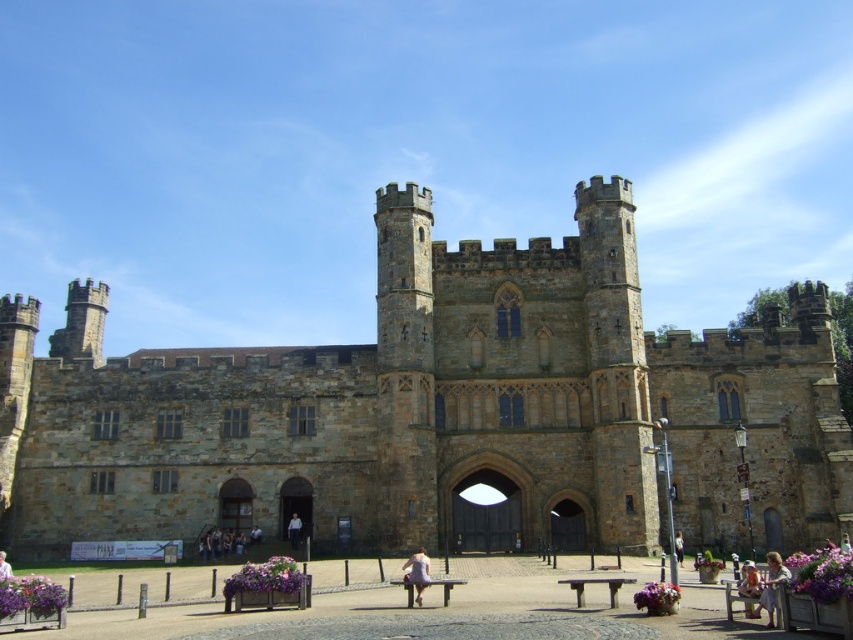
Between white fabric person at center and white cotton shirt at center, which one is positioned lower?

white cotton shirt at center

Between point (297, 544) and point (676, 556), which one is positioned behind?

The point (297, 544) is more distant.

I want to click on white fabric person at center, so click(294, 531).

Looking at this image, who is positioned more to the left, light purple fabric dress at center or light brown hair at lower right?

light purple fabric dress at center is more to the left.

Is point (404, 576) less distant than point (743, 589)?

No, (404, 576) is further to viewer.

Does point (421, 596) come in front of point (743, 582)?

No, (421, 596) is behind (743, 582).

The width and height of the screenshot is (853, 640). I want to click on light purple fabric dress at center, so click(416, 572).

Who is more distant from viewer, (314, 493) or (297, 531)?

Point (314, 493)

Who is positioned more to the left, brown stone castle at center or white fabric person at center?

white fabric person at center

Who is more distant from viewer, (412, 432) or (300, 524)?

The point (300, 524) is more distant.

I want to click on brown stone castle at center, so (434, 410).